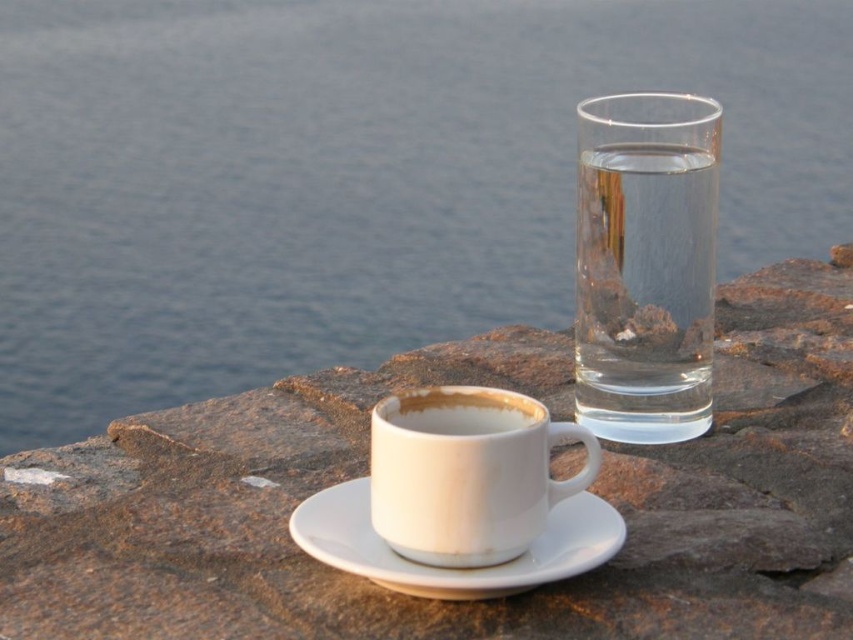
Who is higher up, transparent glass water at right or white matte cup at center?

transparent glass water at right is above.

You are a GUI agent. You are given a task and a screenshot of the screen. Output one action in this format:
    pyautogui.click(x=<x>, y=<y>)
    Task: Click on the transparent glass water at right
    
    Given the screenshot: What is the action you would take?
    pyautogui.click(x=645, y=264)

Is white matte stone at center to the right of white ceramic mug at center from the viewer's perspective?

Indeed, white matte stone at center is positioned on the right side of white ceramic mug at center.

Does white matte stone at center come behind white ceramic mug at center?

Yes.

Is point (234, 582) in front of point (459, 480)?

No.

At what (x,y) coordinates should I click in order to perform the action: click on white matte stone at center. Please return your answer as a coordinate pair (x, y). The height and width of the screenshot is (640, 853). Looking at the image, I should click on (364, 472).

Can you confirm if transparent glass water at upper right is thinner than white matte cup at center?

In fact, transparent glass water at upper right might be wider than white matte cup at center.

Is transparent glass water at upper right to the right of white matte cup at center from the viewer's perspective?

No, transparent glass water at upper right is not to the right of white matte cup at center.

Which is in front, point (318, 332) or point (416, 432)?

Point (416, 432)

The image size is (853, 640). In order to click on transparent glass water at upper right in this screenshot , I will do `click(354, 177)`.